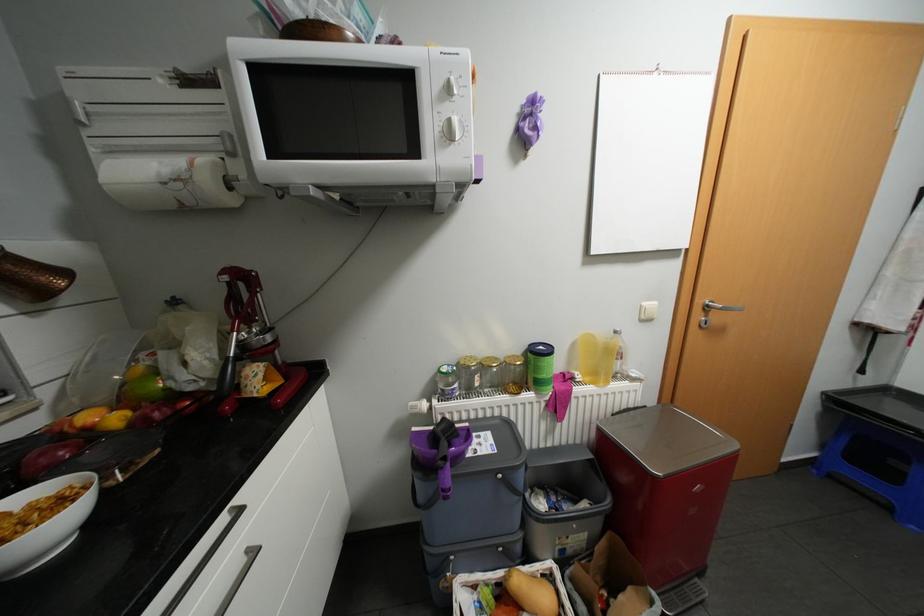
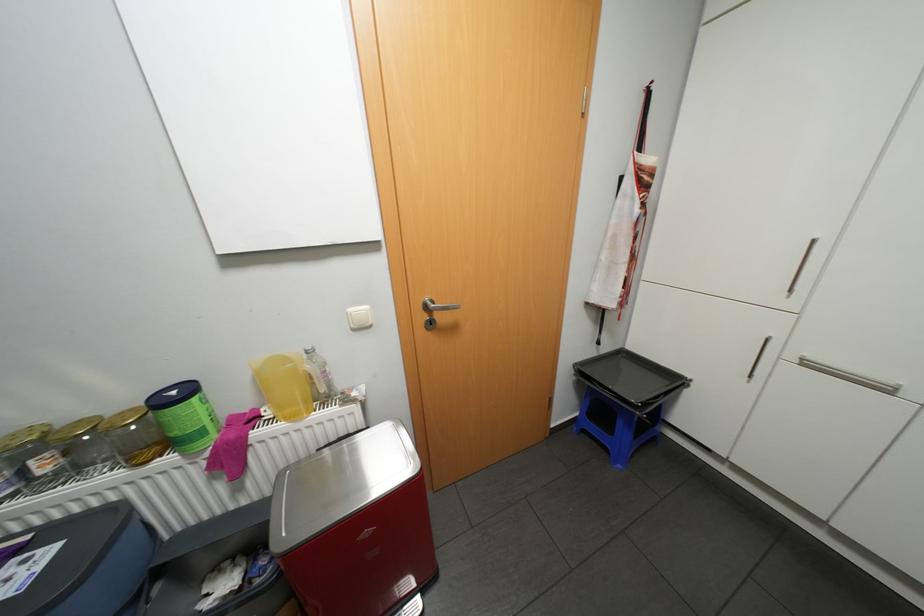
Locate, in the second image, the point that corresponds to point 587,377 in the first image.

(275, 413)